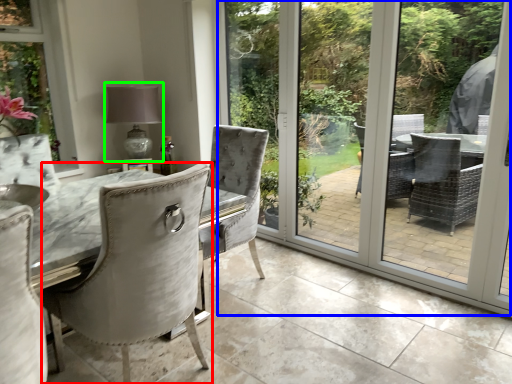
Question: Estimate the real-world distances between objects in this image. Which object is closer to chair (highlighted by a red box), screen door (highlighted by a blue box) or table lamp (highlighted by a green box)?

Choices:
 (A) screen door
 (B) table lamp

Answer: (B)